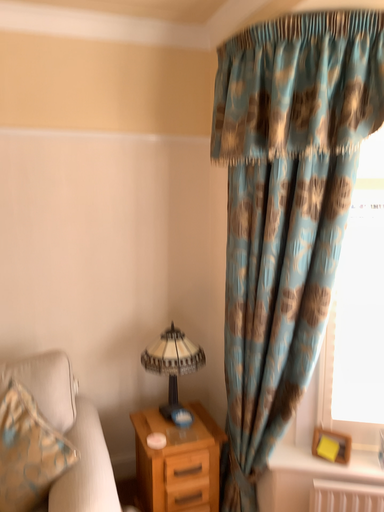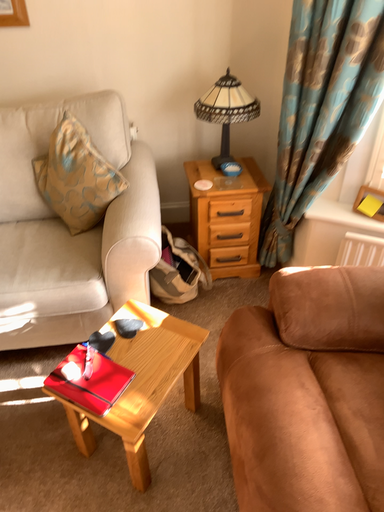
Question: How did the camera likely rotate when shooting the video?

Choices:
 (A) rotated upward
 (B) rotated downward

Answer: (B)